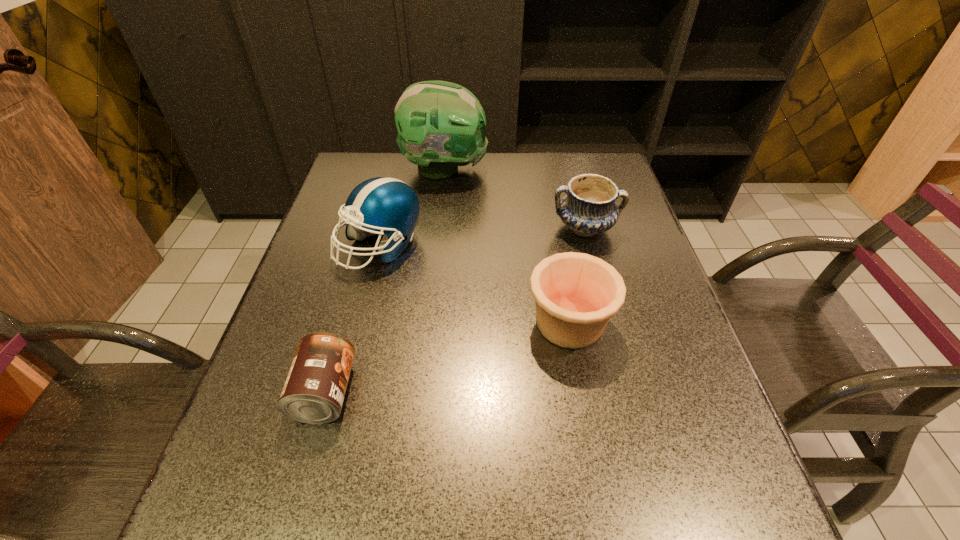
Find the location of `the taller football helmet`. the taller football helmet is located at coordinates (441, 125).

What are the coordinates of `the farthest object` in the screenshot? It's located at (441, 125).

This screenshot has width=960, height=540. I want to click on the shorter football helmet, so click(390, 206).

Find the location of a particular element. This screenshot has height=540, width=960. the nearer football helmet is located at coordinates point(390,206).

I want to click on the farther pottery, so click(589, 208).

You are a GUI agent. You are given a task and a screenshot of the screen. Output one action in this format:
    pyautogui.click(x=<x>, y=<y>)
    Task: Click on the fourth farthest object
    The image size is (960, 540).
    Given the screenshot: What is the action you would take?
    pyautogui.click(x=576, y=294)

Find the location of a particular element. Image resolution: width=960 pixels, height=540 pixels. the shortest object is located at coordinates (315, 387).

This screenshot has height=540, width=960. In order to click on can in this screenshot , I will do `click(315, 387)`.

Find the location of a particular element. The height and width of the screenshot is (540, 960). free space located on the visor of the tallest object is located at coordinates (532, 169).

In order to click on free space located at the front of the shorter football helmet with the faceguard in this screenshot , I will do `click(369, 293)`.